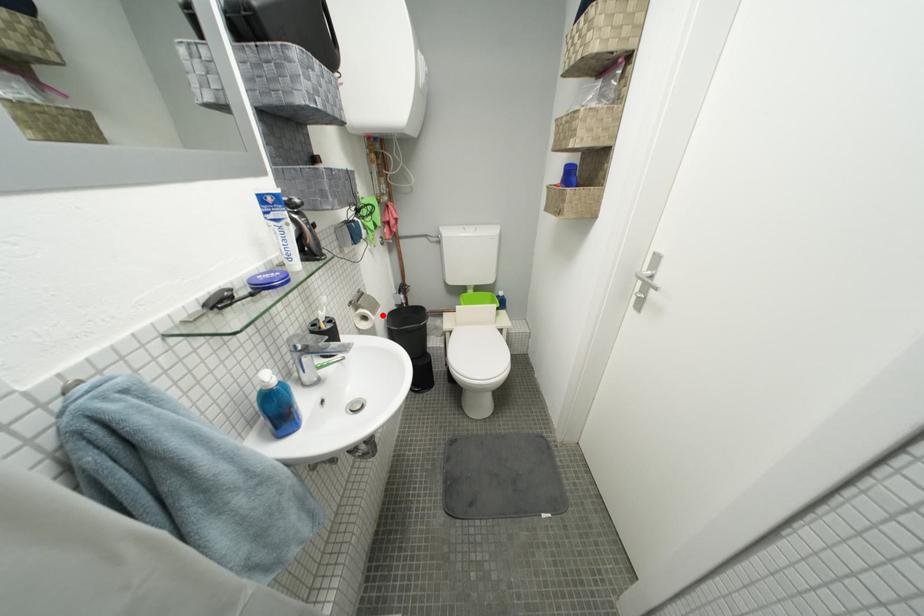
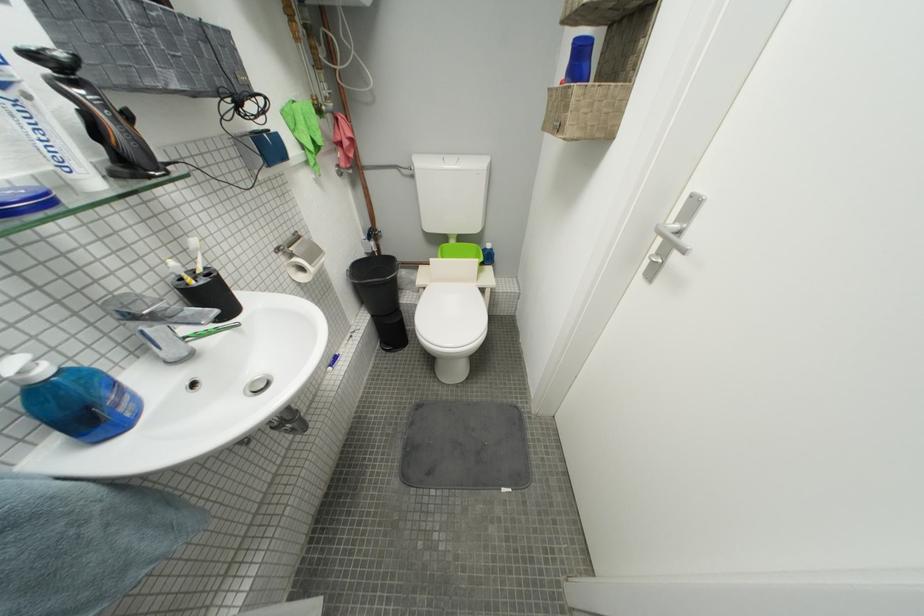
Question: I am providing you with two images of the same scene from different viewpoints. A red point is marked on the first image. Can you still see the location of the red point in image 2?

Choices:
 (A) Yes
 (B) No

Answer: (A)